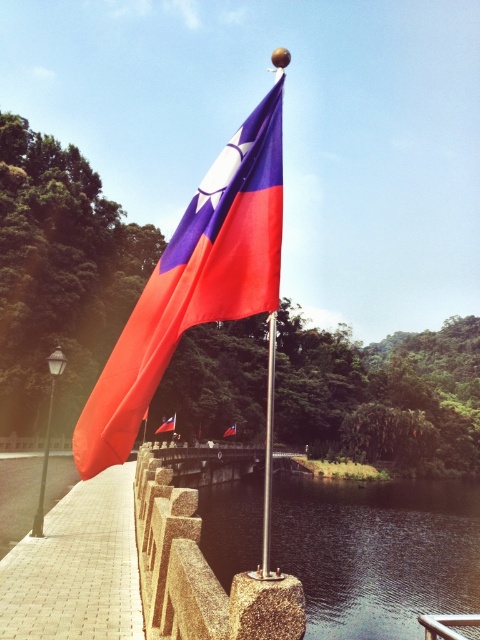
Does point (458, 547) come in front of point (268, 548)?

No, it is behind (268, 548).

Is transparent glass river at lower center to the left of metallic flag pole at center from the viewer's perspective?

No, transparent glass river at lower center is not to the left of metallic flag pole at center.

Which is in front, point (330, 621) or point (266, 515)?

Point (266, 515) is in front.

At what (x,y) coordinates should I click in order to perform the action: click on transparent glass river at lower center. Please return your answer as a coordinate pair (x, y). This screenshot has height=640, width=480. Looking at the image, I should click on (x=377, y=552).

Is silver metallic rail at center to the right of red fabric flag at center from the viewer's perspective?

Yes, silver metallic rail at center is to the right of red fabric flag at center.

Measure the distance between silver metallic rail at center and camera.

4.86 meters

Which is behind, point (448, 620) or point (229, 426)?

Point (229, 426)

I want to click on silver metallic rail at center, so click(446, 625).

Which is more to the right, metallic flag pole at center or silver metallic rail at center?

silver metallic rail at center

Which is more to the left, metallic flag pole at center or silver metallic rail at center?

From the viewer's perspective, metallic flag pole at center appears more on the left side.

Between point (273, 348) and point (430, 618), which one is positioned behind?

Positioned behind is point (430, 618).

In order to click on metallic flag pole at center in this screenshot , I will do `click(268, 445)`.